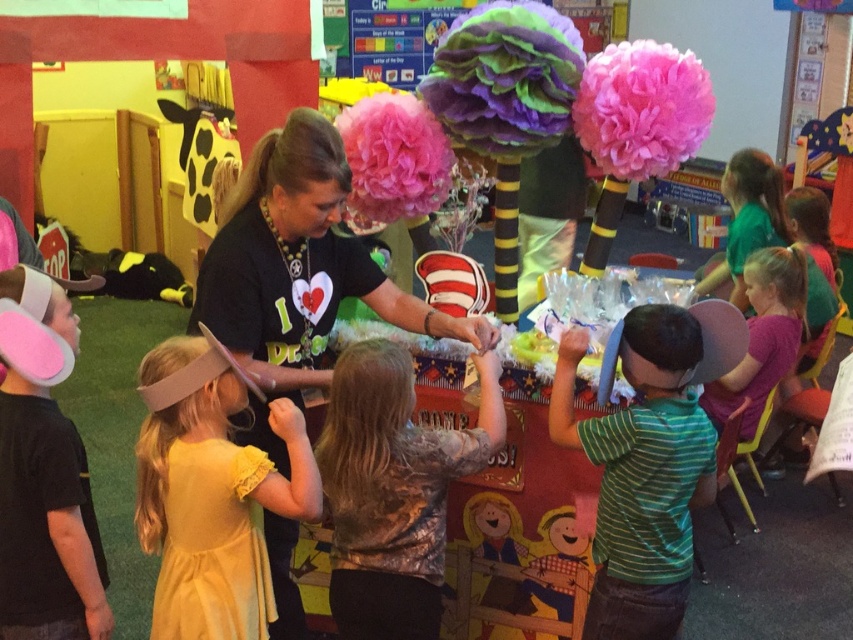
You are a photographer taking a picture of the classroom scene. You notice the yellow satin dress at center and the green striped shirt at center. Which clothing item is positioned lower in the image?

The yellow satin dress at center is located below the green striped shirt at center, so it is positioned lower in the image.

Consider the image. You are a photographer standing at the back of the room. You want to take a photo of both the camouflage shirt at center and the green striped shirt at center. Can you fit both in the frame without moving your position? The camera has a 10 inch field of view.

The camouflage shirt at center is 18.77 inches away from the green striped shirt at center. Since the distance between them exceeds the camera field of view of 10 inches, you cannot fit both in the frame without moving.